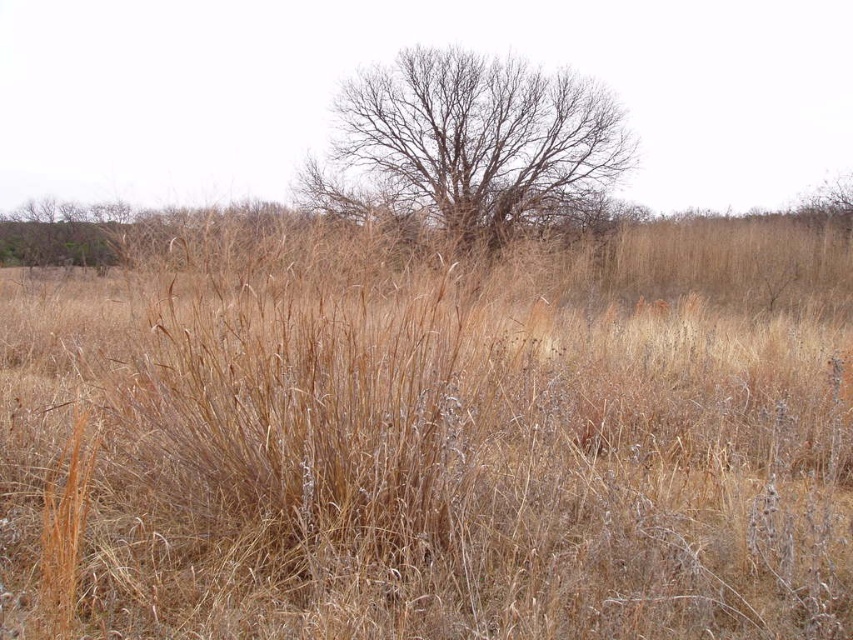
Question: Which object is closer to the camera taking this photo?

Choices:
 (A) bare branches at center
 (B) brown dry grass at center

Answer: (B)

Question: Is brown dry grass at center positioned before bare branches at center?

Choices:
 (A) yes
 (B) no

Answer: (A)

Question: Can you confirm if brown dry grass at center is positioned above bare branches at center?

Choices:
 (A) yes
 (B) no

Answer: (B)

Question: Among these objects, which one is nearest to the camera?

Choices:
 (A) brown dry grass at center
 (B) bare branches at center

Answer: (A)

Question: Among these points, which one is nearest to the camera?

Choices:
 (A) (500, 81)
 (B) (834, 353)

Answer: (B)

Question: Can you confirm if brown dry grass at center is smaller than bare branches at center?

Choices:
 (A) no
 (B) yes

Answer: (A)